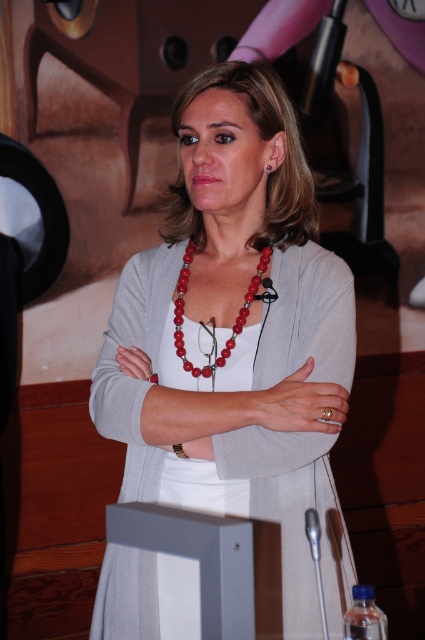
Question: From the image, what is the correct spatial relationship of matte gray cardigan at center in relation to red beaded necklace at center?

Choices:
 (A) left
 (B) right

Answer: (B)

Question: Estimate the real-world distances between objects in this image. Which object is closer to the matte gray cardigan at center?

Choices:
 (A) red glass earring at center
 (B) red beaded necklace at center

Answer: (B)

Question: Which of the following is the farthest from the observer?

Choices:
 (A) (343, 342)
 (B) (244, 300)

Answer: (B)

Question: Can you confirm if matte gray cardigan at center is wider than red glass earring at center?

Choices:
 (A) no
 (B) yes

Answer: (B)

Question: Which point is farther from the camera taking this photo?

Choices:
 (A) (260, 260)
 (B) (325, 342)

Answer: (A)

Question: Can you confirm if matte gray cardigan at center is smaller than red beaded necklace at center?

Choices:
 (A) yes
 (B) no

Answer: (B)